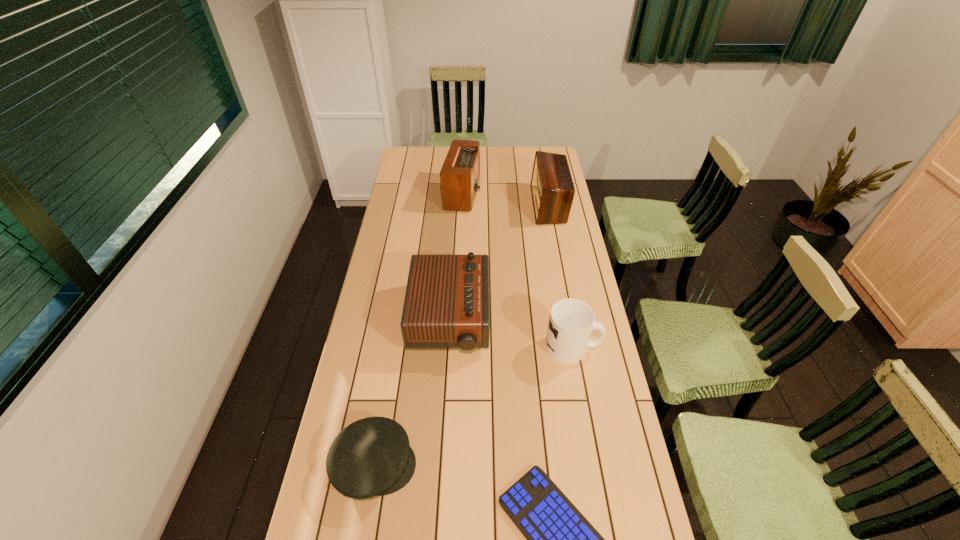
At what (x,y) coordinates should I click in order to perform the action: click on the rightmost radio receiver. Please return your answer as a coordinate pair (x, y). This screenshot has height=540, width=960. Looking at the image, I should click on (552, 188).

Locate an element on the screen. the nearest radio receiver is located at coordinates (446, 305).

You are a GUI agent. You are given a task and a screenshot of the screen. Output one action in this format:
    pyautogui.click(x=<x>, y=<y>)
    Task: Click on the mug
    
    Given the screenshot: What is the action you would take?
    pyautogui.click(x=571, y=322)

The image size is (960, 540). What are the coordinates of `the second shortest object` in the screenshot? It's located at (370, 457).

Find the location of a particular element. free space located on the front-facing side of the rightmost radio receiver is located at coordinates (514, 205).

Where is `free region located 0.220m on the front-facing side of the rightmost radio receiver`? This screenshot has width=960, height=540. free region located 0.220m on the front-facing side of the rightmost radio receiver is located at coordinates (486, 205).

Find the location of a particular element. The height and width of the screenshot is (540, 960). free space located 0.360m on the front-facing side of the rightmost radio receiver is located at coordinates 455,205.

The image size is (960, 540). Find the location of `vacant space situated 0.300m on the tuning display of the nearest radio receiver`. vacant space situated 0.300m on the tuning display of the nearest radio receiver is located at coordinates (573, 320).

Identify the location of free space located on the front-facing side of the fifth tallest object. The image size is (960, 540). (544, 465).

At what (x,y) coordinates should I click in order to perform the action: click on object located at the left edge. Please return your answer as a coordinate pair (x, y). This screenshot has height=540, width=960. Looking at the image, I should click on (370, 457).